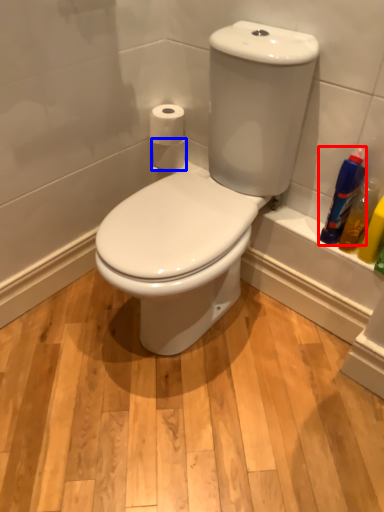
Question: Which object is closer to the camera taking this photo, cleaning product (highlighted by a red box) or toilet paper (highlighted by a blue box)?

Choices:
 (A) cleaning product
 (B) toilet paper

Answer: (A)